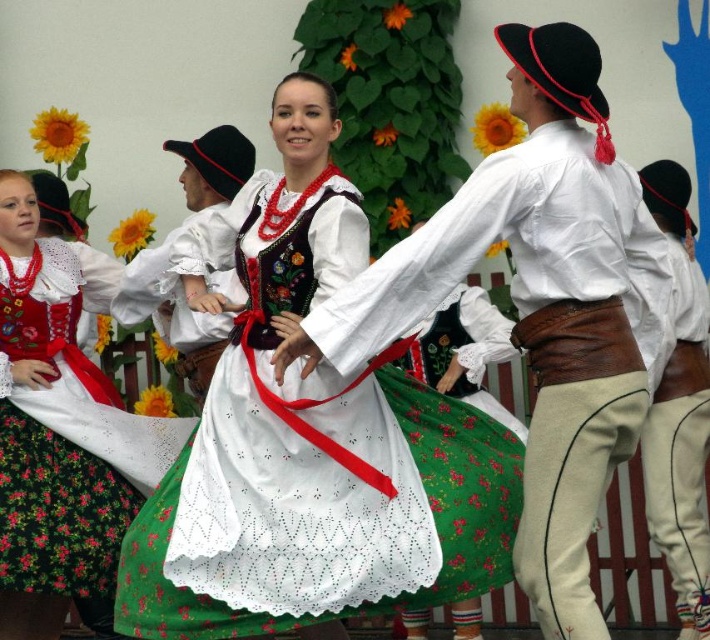
You are a photographer at the cultural festival. You want to capture the central dancer in a way that highlights her dress. Since the white satin dress at center and the white lace dress at center are both in the frame, which dress should you focus on to ensure it appears thinner in the photo?

The white satin dress at center is thinner than the white lace dress at center, so focusing on the white satin dress at center will make it appear thinner in the photo.

You are a photographer standing at the camera position. You want to capture a closeup shot of the white lace dress at center. Considering the distance, do you need to use a zoom lens?

The white lace dress at center is 8.40 meters away from camera. To capture a closeup shot from that distance, you would need to use a zoom lens to bring the subject closer.